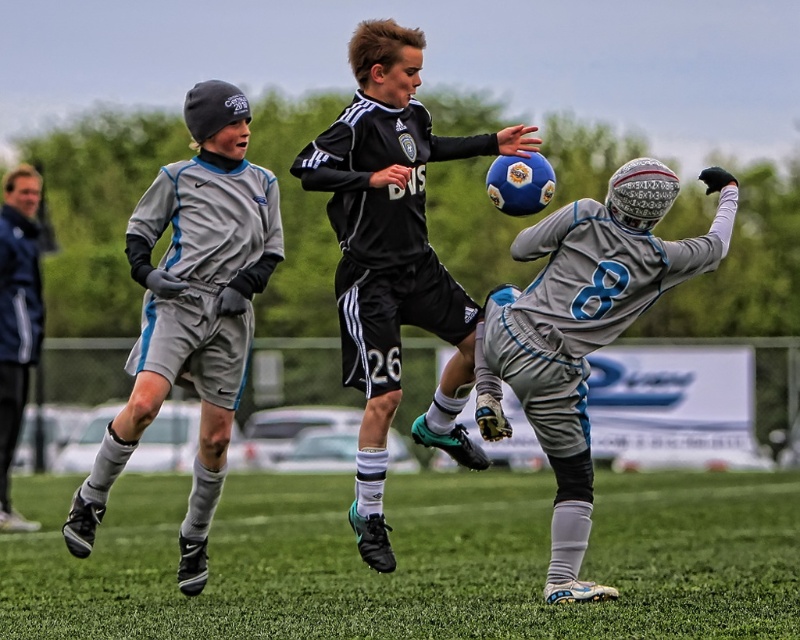
You are a referee observing the soccer match. You notice the green grass at center and the gray matte soccer jersey at center. Which object is closer to the front of the image?

The green grass at center is in front of the gray matte soccer jersey at center, so the green grass at center is closer to the front of the image.

You are a soccer coach analyzing the game from the sidelines. You notice two points marked on the field at coordinates point (x=332, y=224) and point (x=180, y=180). Which point is closer to your vantage point on the sidelines?

Point (x=332, y=224) is closer to the camera than point (x=180, y=180), so the point (x=332, y=224) is closer to your vantage point on the sidelines.

You are a photographer at the soccer match. You want to take a photo of the gray matte soccer uniform at left and the dark blue jacket at left. Which one should you zoom in on to capture more details?

The gray matte soccer uniform at left is smaller than the dark blue jacket at left, so you should zoom in on the gray matte soccer uniform at left to capture more details.